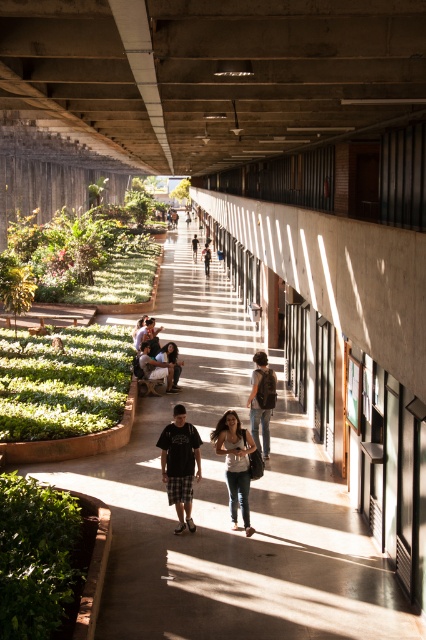
You are a student carrying a matte black backpack at center and a denim jacket at center. You want to place both items on a bench that can only hold items with a combined width of 1 meter. Can you fit both items on the bench?

The matte black backpack at center might be wider than denim jacket at center, so it is uncertain if their combined width would exceed 1 meter. You should check their exact widths before placing them on the bench.

You are a student walking along the walkway and notice both the matte black backpack at center and the denim jacket at center. Which item is taller?

The denim jacket at center is taller than the matte black backpack at center.

You are a student carrying a backpack and need to walk through the covered walkway. You see a brown leather backpack at right and a dark brown leather backpack at center. Which backpack is wider?

The dark brown leather backpack at center is wider than the brown leather backpack at right.